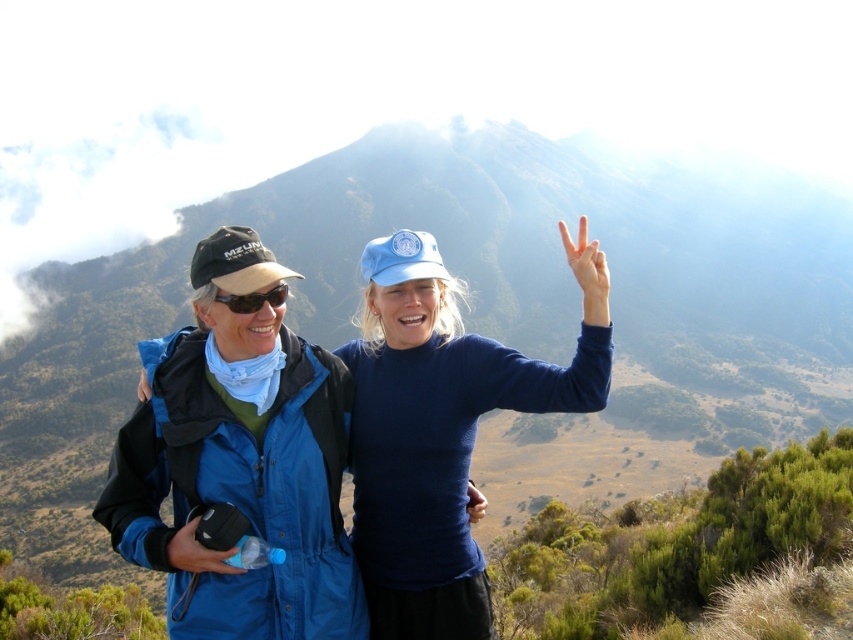
From the picture: Does blue fabric jacket at center have a smaller size compared to matte black goggles at left?

Actually, blue fabric jacket at center might be larger than matte black goggles at left.

Does blue fabric jacket at center appear on the right side of matte black goggles at left?

Indeed, blue fabric jacket at center is positioned on the right side of matte black goggles at left.

Describe the element at coordinates (444, 428) in the screenshot. This screenshot has height=640, width=853. I see `blue fabric jacket at center` at that location.

At what (x,y) coordinates should I click in order to perform the action: click on blue fabric jacket at center. Please return your answer as a coordinate pair (x, y). Image resolution: width=853 pixels, height=640 pixels. Looking at the image, I should click on (444, 428).